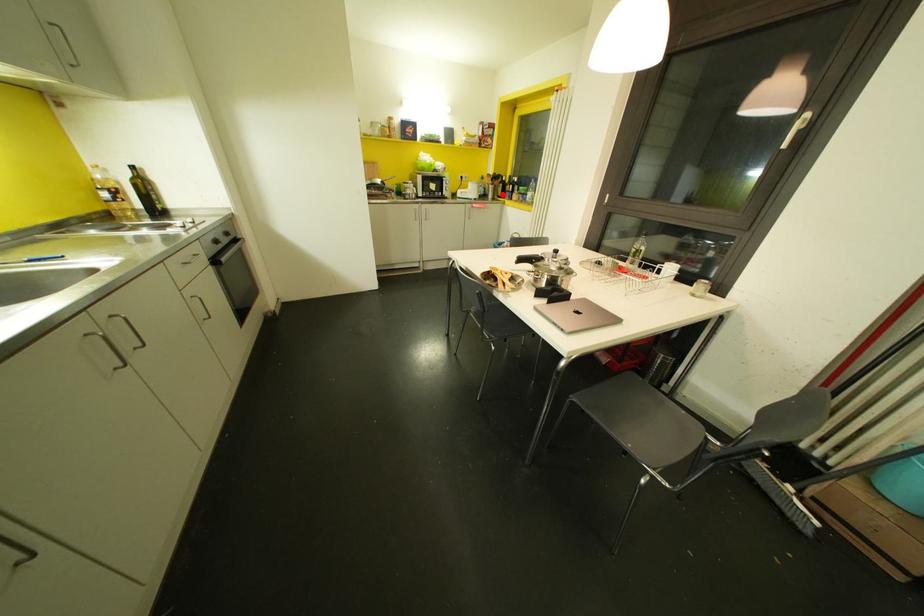
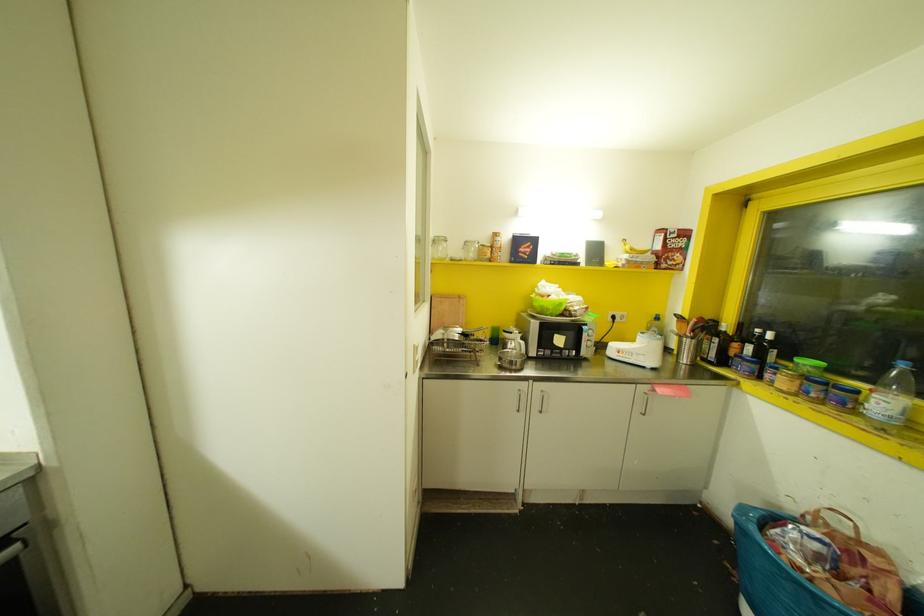
In the second image, find the point that corresponds to the highlighted location in the first image.

(723, 361)